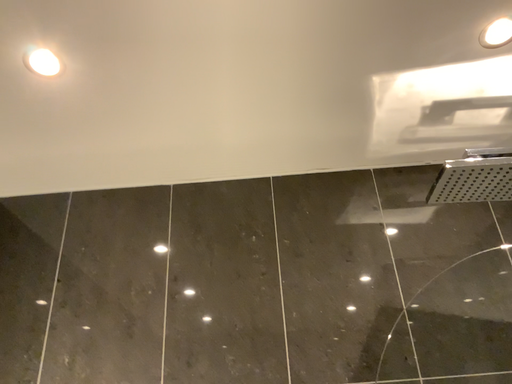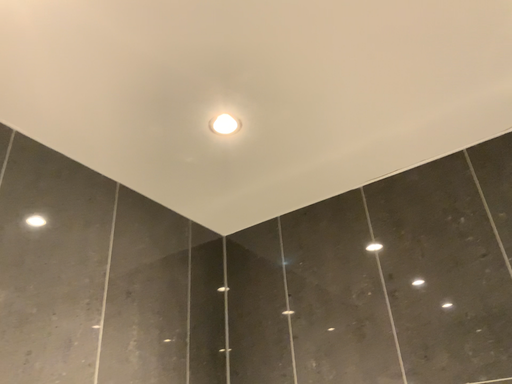
Question: How did the camera likely rotate when shooting the video?

Choices:
 (A) rotated left
 (B) rotated right

Answer: (A)